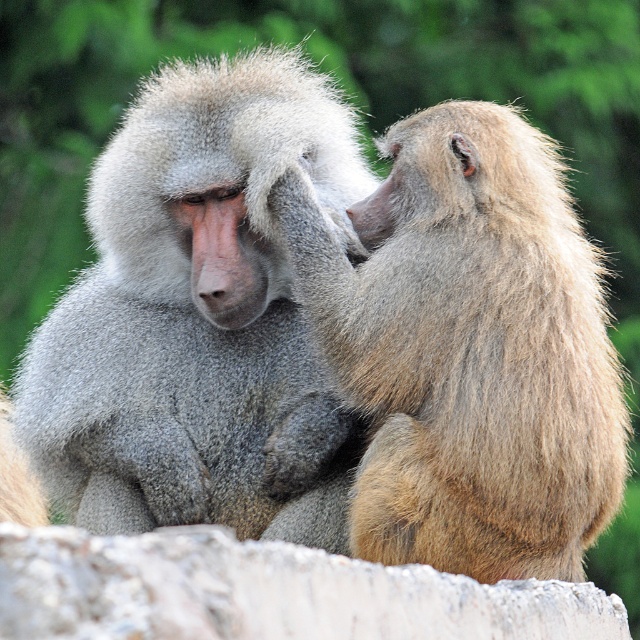
Question: Can you confirm if gray fur monkey at left is smaller than gray fur monkey at center?

Choices:
 (A) no
 (B) yes

Answer: (A)

Question: Is gray fur monkey at left to the right of gray fur monkey at center from the viewer's perspective?

Choices:
 (A) yes
 (B) no

Answer: (B)

Question: Which point is farther to the camera?

Choices:
 (A) (500, 145)
 (B) (60, 323)

Answer: (B)

Question: Which object appears farthest from the camera in this image?

Choices:
 (A) gray fur monkey at center
 (B) gray fur monkey at left

Answer: (B)

Question: Does gray fur monkey at left have a larger size compared to gray fur monkey at center?

Choices:
 (A) no
 (B) yes

Answer: (B)

Question: Among these points, which one is nearest to the camera?

Choices:
 (A) (400, 356)
 (B) (196, 396)

Answer: (A)